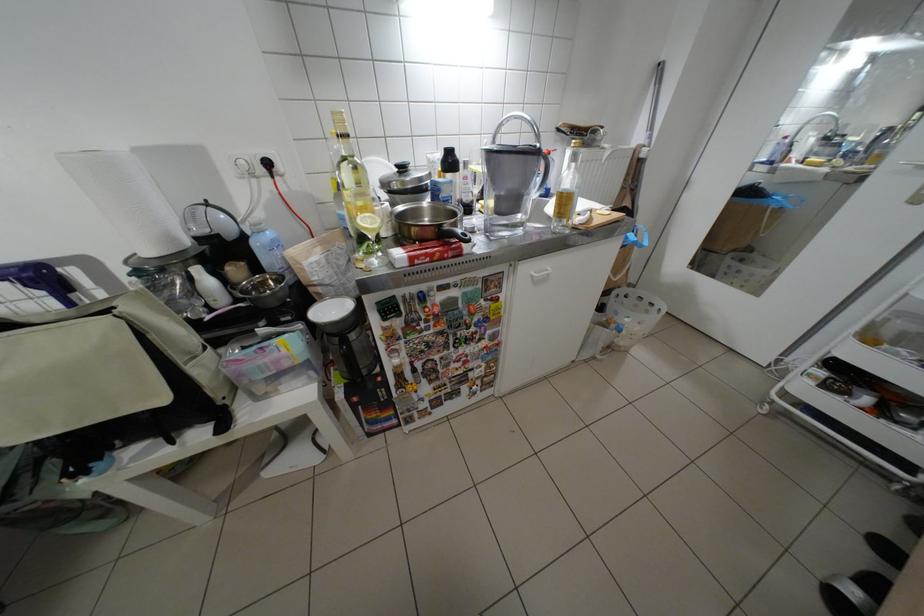
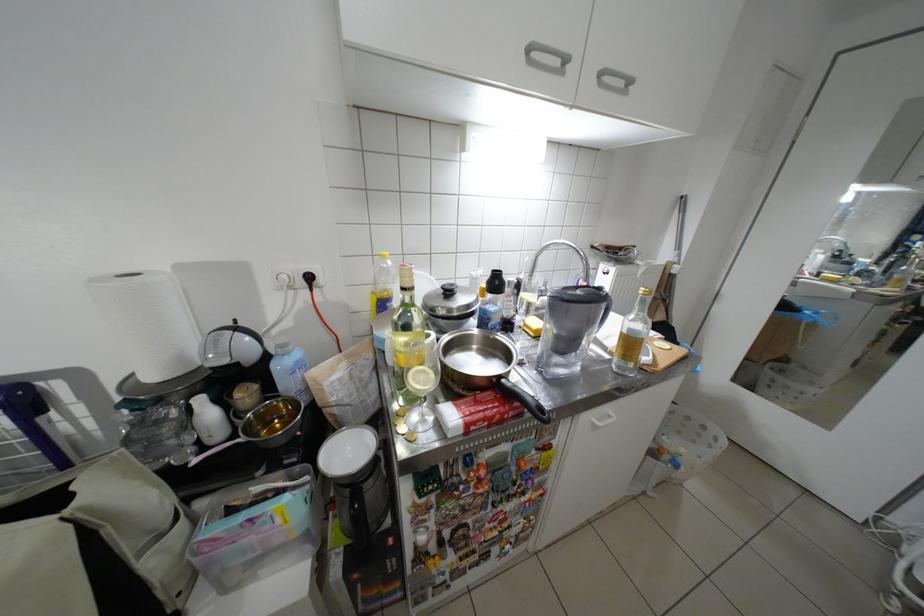
Where in the second image is the point corresponding to point 162,254 from the first image?

(164, 378)